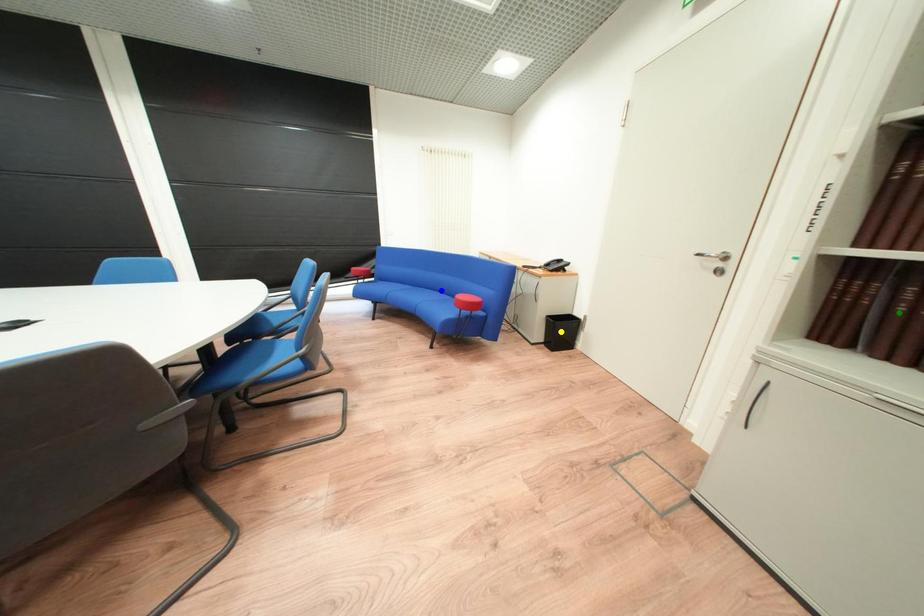
Order these from nearest to farthest:
blue point, green point, yellow point

1. green point
2. blue point
3. yellow point